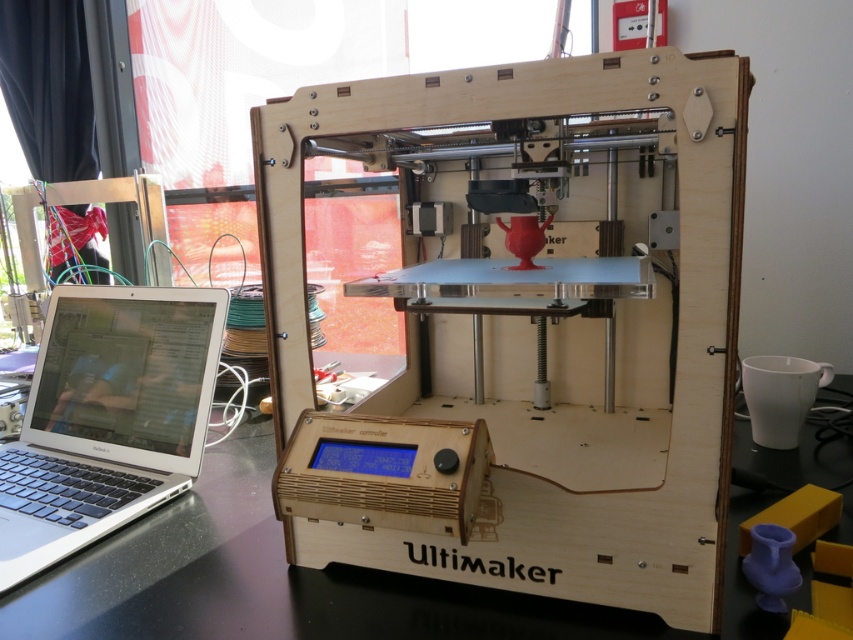
Question: Is wooden ultimaker 3d printer at center closer to camera compared to silver metallic laptop at left?

Choices:
 (A) yes
 (B) no

Answer: (A)

Question: Based on their relative distances, which object is farther from the silver metallic laptop at left?

Choices:
 (A) black glossy table at lower left
 (B) wooden ultimaker 3d printer at center

Answer: (B)

Question: Considering the real-world distances, which object is closest to the silver metallic laptop at left?

Choices:
 (A) black glossy table at lower left
 (B) wooden ultimaker 3d printer at center

Answer: (A)

Question: Is black glossy table at lower left bigger than silver metallic laptop at left?

Choices:
 (A) no
 (B) yes

Answer: (B)

Question: Does wooden ultimaker 3d printer at center appear under black glossy table at lower left?

Choices:
 (A) no
 (B) yes

Answer: (A)

Question: Among these points, which one is farthest from the camera?

Choices:
 (A) (141, 582)
 (B) (573, 125)
 (C) (84, 502)

Answer: (B)